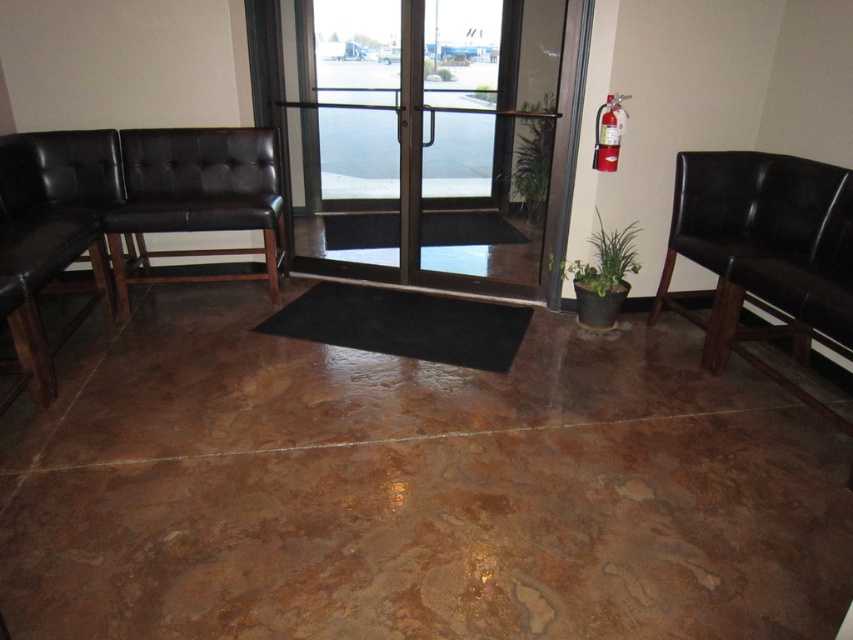
You are a person who is 1.7 meters tall standing in the waiting area. You see the black leather chair at right and the black rubber mat at center. Which object is taller than you?

The black leather chair at right is taller than the black rubber mat at center, but since you are 1.7 meters tall, neither of these objects are taller than you.

You are a person carrying a heavy backpack and need to sit down. You see the matte black bench at left and the black rubber mat at center. Which one is a better option for sitting?

The matte black bench at left is a better option for sitting because it is designed for seating, while the black rubber mat at center is likely meant for traction or moisture absorption and may not be comfortable or appropriate for sitting.